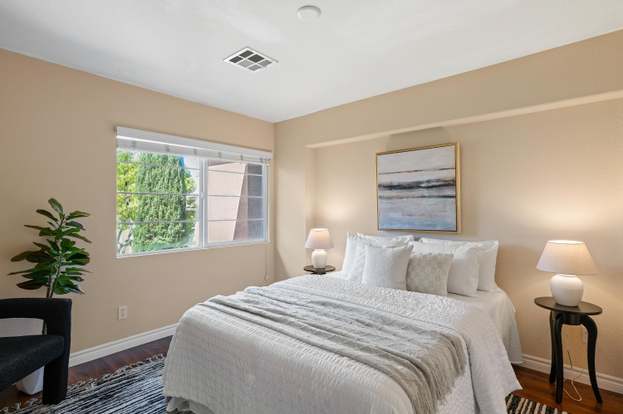
Locate an element on the screen. The image size is (623, 414). window panes is located at coordinates click(x=221, y=237), click(x=214, y=209), click(x=222, y=189), click(x=227, y=167), click(x=169, y=164), click(x=166, y=179), click(x=164, y=207), click(x=159, y=235).